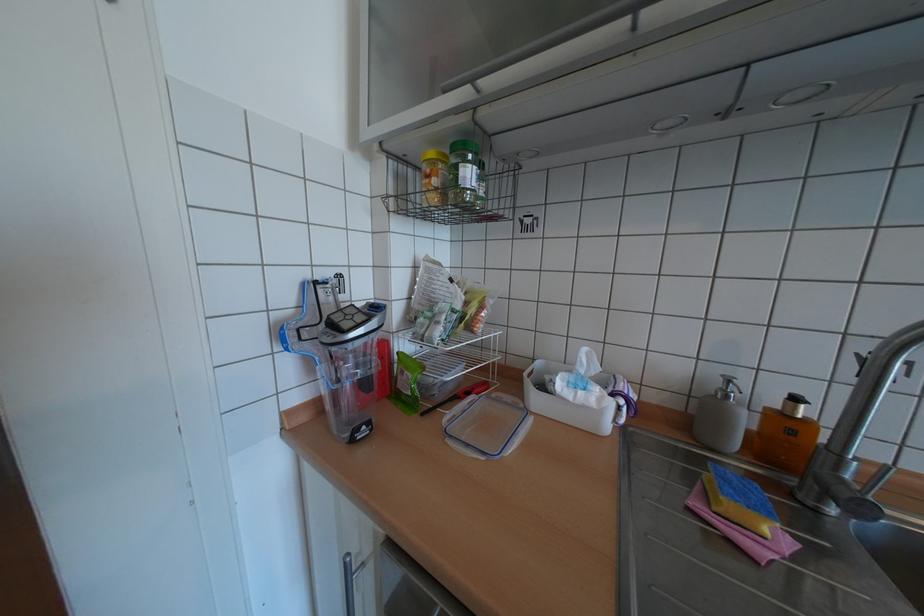
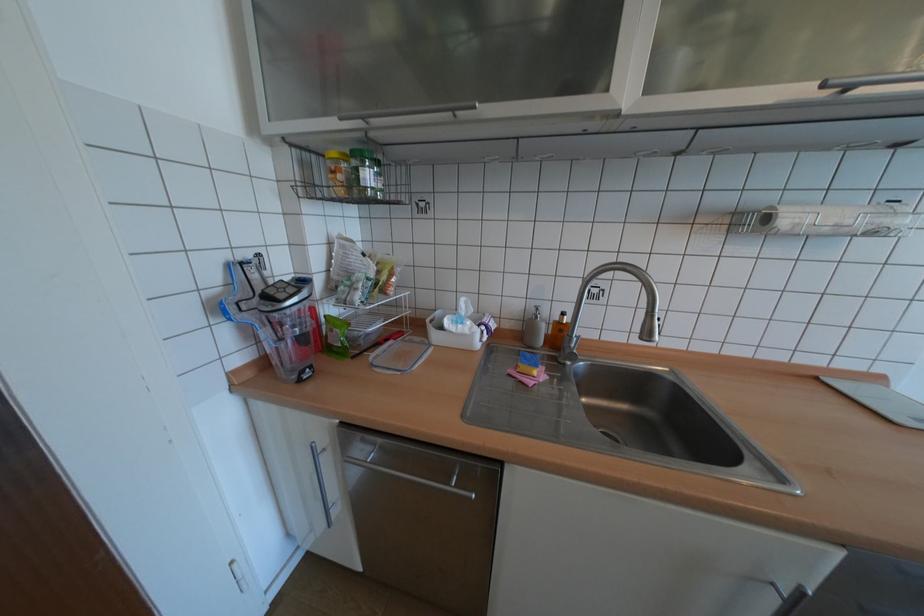
Question: I am providing you with two images of the same scene from different viewpoints. Which of the following objects are not visible in image2?

Choices:
 (A) clear plastic lid
 (B) paper towel roll
 (C) white tissue
 (D) none of these

Answer: (D)